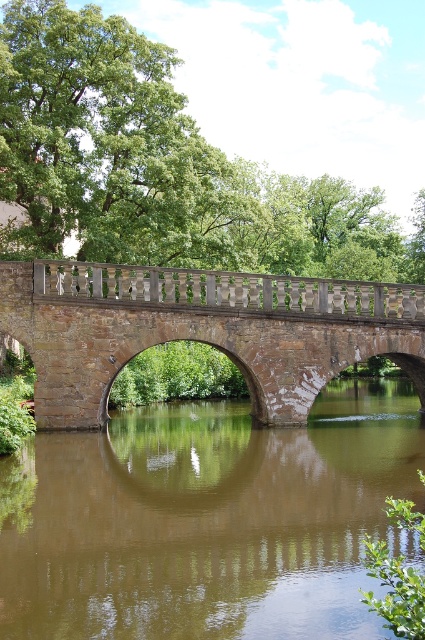
How far apart are brown smooth water at center and brown stone bridge at center?

brown smooth water at center is 23.00 feet away from brown stone bridge at center.

This screenshot has width=425, height=640. Describe the element at coordinates (207, 520) in the screenshot. I see `brown smooth water at center` at that location.

Locate an element on the screen. brown smooth water at center is located at coordinates pyautogui.click(x=207, y=520).